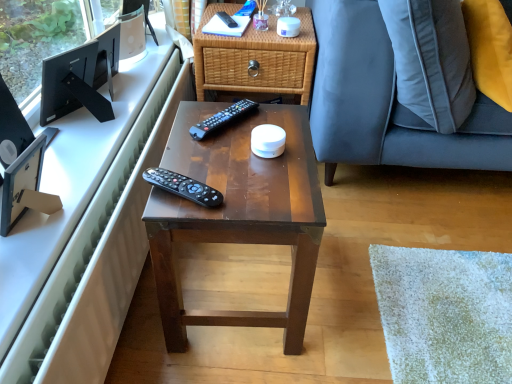
The height and width of the screenshot is (384, 512). What are the coordinates of `vacant space situated above woven wood nightstand at upper center (from a real-world perspective)` in the screenshot? It's located at pyautogui.click(x=237, y=25).